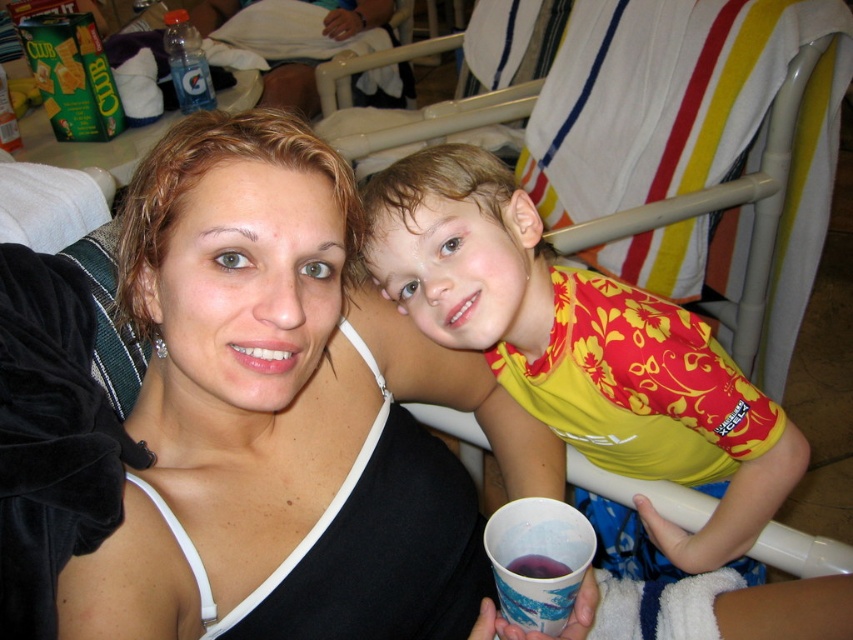
You are a photographer trying to capture a closeup of the purple paper cup at lower center without including the yellow floral shirt at upper right in the frame. Based on their distance, is this possible?

The yellow floral shirt at upper right is only 10.57 inches away from the purple paper cup at lower center, so it might be challenging to capture a closeup of the purple paper cup at lower center without including the yellow floral shirt at upper right in the frame due to their close proximity.

In the scene where a mother and child are sitting together at a poolside, you notice the yellow floral shirt at upper right and the purple matte liquid at cup right. Which object is wider?

The yellow floral shirt at upper right is wider than the purple matte liquid at cup right according to the description.

You are a photographer trying to capture a closeup of the woman and the child in the image. You notice two points of interest marked at coordinates point (473, 298) and point (532, 605). Which point is closer to the camera?

Point (473, 298) is closer to the camera than point (532, 605) because it is further to the viewer.